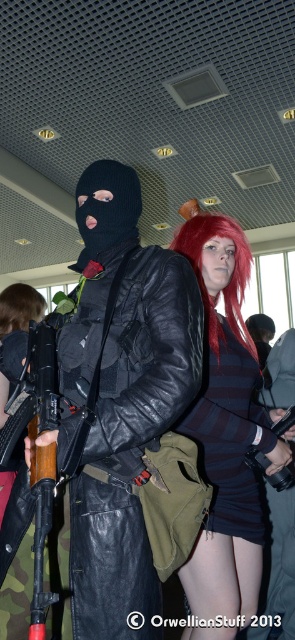
Question: Is brown matte hair at upper left to the left of matte black gun at center from the viewer's perspective?

Choices:
 (A) yes
 (B) no

Answer: (A)

Question: Which object is the closest to the brown matte hair at upper left?

Choices:
 (A) matte black gun at center
 (B) shiny red wig at center
 (C) matte black leather jacket at center
 (D) striped fabric skirt at center

Answer: (B)

Question: Can you confirm if shiny red wig at center is positioned below brown matte hair at upper left?

Choices:
 (A) yes
 (B) no

Answer: (A)

Question: Which object appears farthest from the camera in this image?

Choices:
 (A) striped fabric skirt at center
 (B) shiny red wig at center
 (C) matte black gun at center

Answer: (C)

Question: Does matte black leather jacket at center appear on the left side of matte black gun at center?

Choices:
 (A) no
 (B) yes

Answer: (B)

Question: Which object appears farthest from the camera in this image?

Choices:
 (A) matte black gun at center
 (B) striped fabric skirt at center

Answer: (A)